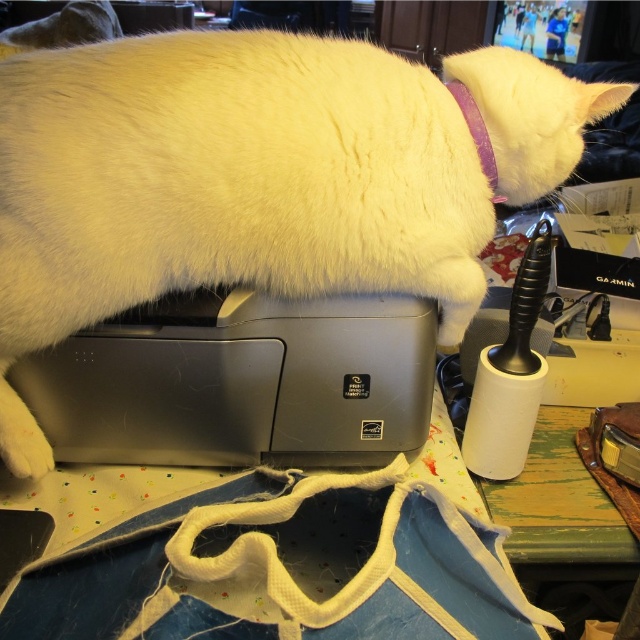
Question: Is white fluffy cat at upper center further to camera compared to purple fabric neckband at upper right?

Choices:
 (A) no
 (B) yes

Answer: (A)

Question: Which object appears closest to the camera in this image?

Choices:
 (A) satin silver printer at center
 (B) white fluffy cat at upper center

Answer: (B)

Question: Which of the following is the farthest from the observer?

Choices:
 (A) purple fabric neckband at upper right
 (B) satin silver printer at center
 (C) white fluffy cat at upper center

Answer: (A)

Question: Which point is farther to the camera?

Choices:
 (A) white fluffy cat at upper center
 (B) satin silver printer at center
 (C) purple fabric neckband at upper right

Answer: (C)

Question: Can you confirm if white fluffy cat at upper center is positioned above satin silver printer at center?

Choices:
 (A) yes
 (B) no

Answer: (A)

Question: Is white fluffy cat at upper center above purple fabric neckband at upper right?

Choices:
 (A) yes
 (B) no

Answer: (B)